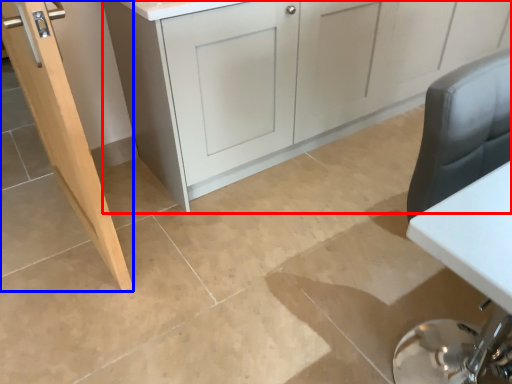
Question: Which point is further to the camera, cabinetry (highlighted by a red box) or door (highlighted by a blue box)?

Choices:
 (A) cabinetry
 (B) door

Answer: (A)